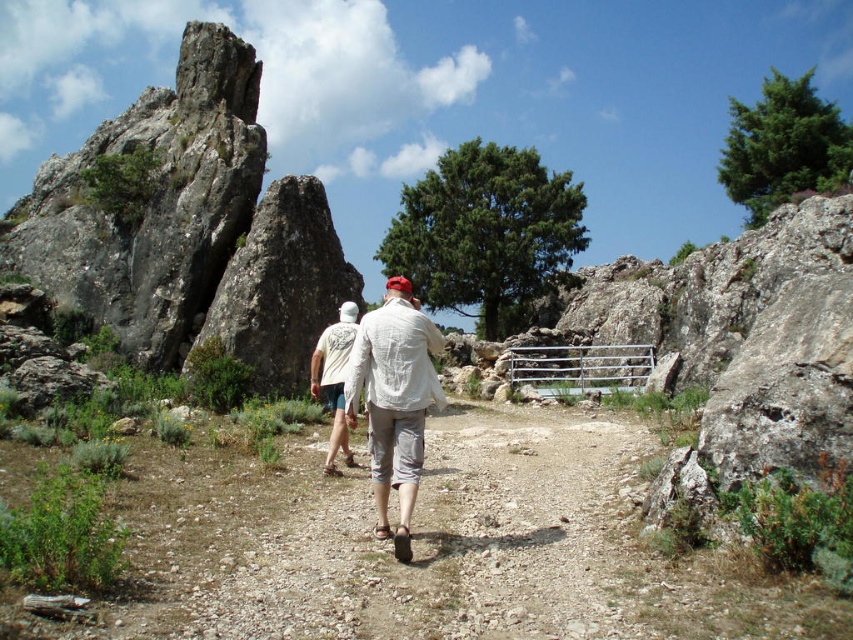
You are a hiker who wants to take a photo of the rough gray rock formation at left and the white cotton shirt at center. Which object should you focus on first if you want to capture both in the same frame without moving the camera?

You should focus on the rough gray rock formation at left first because it is above the white cotton shirt at center, so adjusting focus to the higher object ensures both are in the frame.

You are a hiker planning to walk from the rough gray rock formation at left to the white linen shirt at center. Which direction should you head to reach your destination?

To reach the white linen shirt at center from the rough gray rock formation at left, you should head to the right since the white linen shirt at center is located to the right of the rough gray rock formation at left.